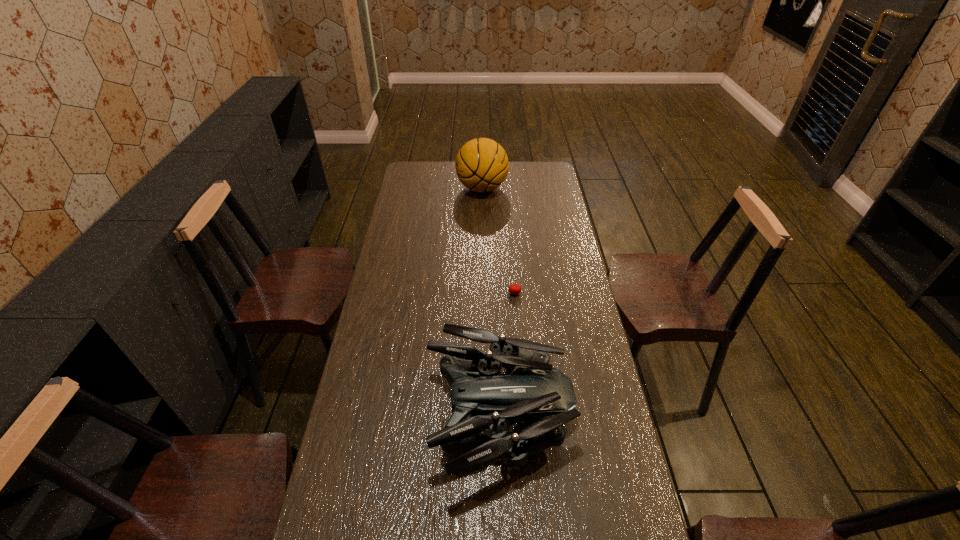
You are a GUI agent. You are given a task and a screenshot of the screen. Output one action in this format:
    pyautogui.click(x=<x>, y=<y>)
    Task: Click on the free space located on the left of the shortest object
    The image size is (960, 540).
    Given the screenshot: What is the action you would take?
    pyautogui.click(x=466, y=293)

Where is `object that is at the far edge`? object that is at the far edge is located at coordinates (481, 164).

Image resolution: width=960 pixels, height=540 pixels. Identify the location of object at the right edge. (482, 399).

Image resolution: width=960 pixels, height=540 pixels. I want to click on free spot at the left edge of the desktop, so click(376, 384).

Identify the location of free region at the right edge. This screenshot has width=960, height=540. (617, 437).

Locate an element on the screen. The height and width of the screenshot is (540, 960). free location at the far right corner is located at coordinates (547, 165).

Locate an element on the screen. This screenshot has width=960, height=540. empty location between the basketball and the second shortest object is located at coordinates (491, 302).

This screenshot has height=540, width=960. What are the coordinates of `free space between the basketball and the cherry` in the screenshot? It's located at (498, 241).

Image resolution: width=960 pixels, height=540 pixels. Identify the location of free spot between the farthest object and the cherry. (498, 241).

Find the location of a particular element. unoccupied position between the farthest object and the drone is located at coordinates (491, 302).